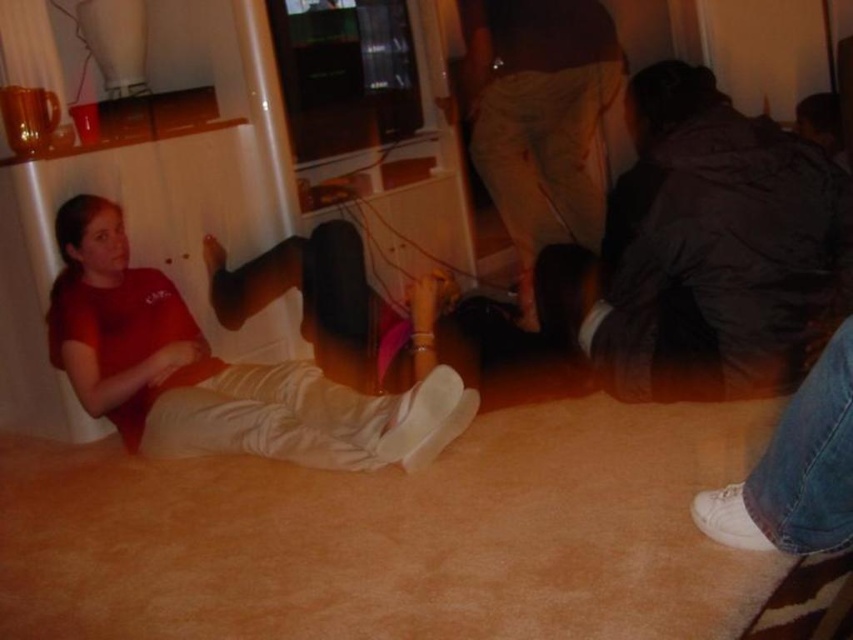
Which is in front, point (759, 269) or point (117, 320)?

Positioned in front is point (759, 269).

Looking at this image, which of these two, dark brown jacket at lower right or matte red t-shirt at left, stands shorter?

With less height is matte red t-shirt at left.

Does point (833, 188) come farther from viewer compared to point (335, 408)?

No.

Locate an element on the screen. This screenshot has width=853, height=640. dark brown jacket at lower right is located at coordinates (705, 252).

Does point (691, 205) lie in front of point (578, 48)?

Yes.

Between dark brown jacket at lower right and light brown cotton pants at center, which one is positioned higher?

light brown cotton pants at center is above.

Where is `dark brown jacket at lower right`? dark brown jacket at lower right is located at coordinates (705, 252).

The image size is (853, 640). Describe the element at coordinates (218, 371) in the screenshot. I see `matte red t-shirt at left` at that location.

The height and width of the screenshot is (640, 853). Identify the location of matte red t-shirt at left. (218, 371).